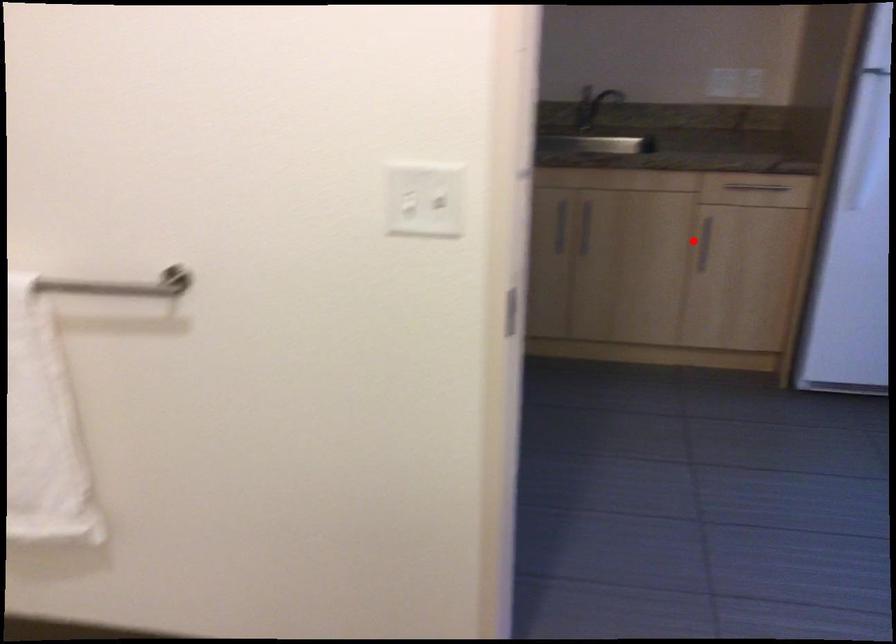
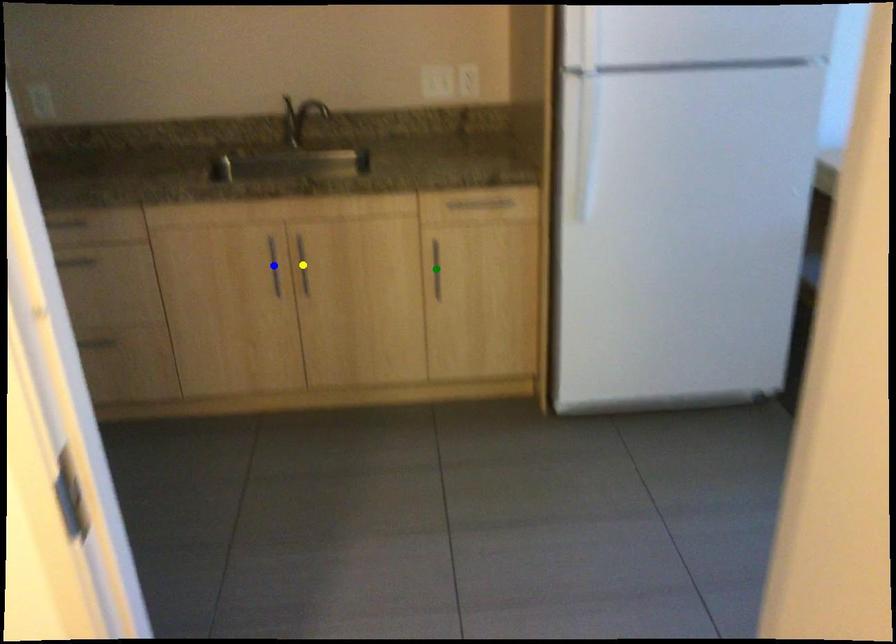
Question: I am providing you with two images of the same scene from different viewpoints. A red point is marked on the first image. You are given multiple points on the second image. In image 2, which mark is for the same physical point as the one in image 1?

Choices:
 (A) blue point
 (B) green point
 (C) yellow point

Answer: (B)